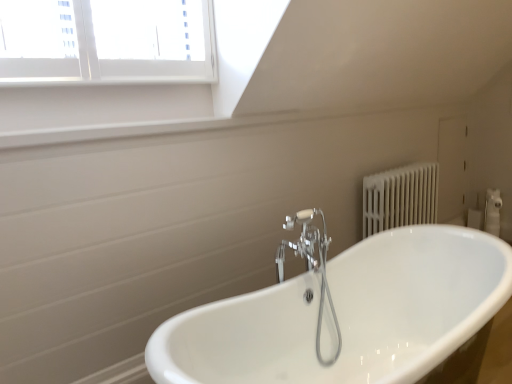
Question: Is point (287, 218) positioned closer to the camera than point (209, 380)?

Choices:
 (A) closer
 (B) farther

Answer: (B)

Question: Would you say chrome metallic faucet at center is inside or outside white glossy bathtub at center?

Choices:
 (A) outside
 (B) inside

Answer: (A)

Question: From a real-world perspective, relative to white glossy bathtub at center, is chrome metallic faucet at center vertically above or below?

Choices:
 (A) below
 (B) above

Answer: (B)

Question: Considering the positions of white glossy bathtub at center and chrome metallic faucet at center in the image, is white glossy bathtub at center bigger or smaller than chrome metallic faucet at center?

Choices:
 (A) small
 (B) big

Answer: (B)

Question: Choose the correct answer: Is white glossy bathtub at center inside chrome metallic faucet at center or outside it?

Choices:
 (A) inside
 (B) outside

Answer: (B)

Question: Would you say white glossy bathtub at center is to the left or to the right of chrome metallic faucet at center in the picture?

Choices:
 (A) left
 (B) right

Answer: (B)

Question: Is point (435, 370) positioned closer to the camera than point (309, 233)?

Choices:
 (A) farther
 (B) closer

Answer: (A)